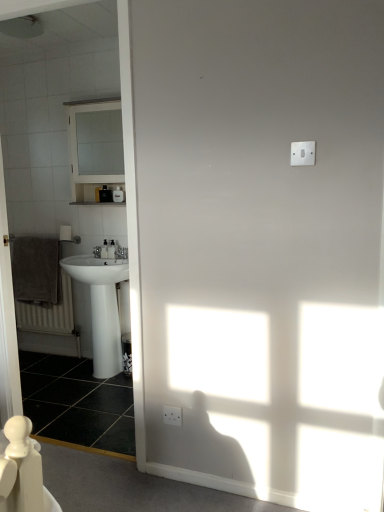
Question: From the image's perspective, does brown textured towel at left appear higher than white glossy medicine cabinet at upper left?

Choices:
 (A) no
 (B) yes

Answer: (A)

Question: Is the position of brown textured towel at left less distant than that of white glossy medicine cabinet at upper left?

Choices:
 (A) yes
 (B) no

Answer: (B)

Question: From a real-world perspective, does brown textured towel at left stand above white glossy medicine cabinet at upper left?

Choices:
 (A) no
 (B) yes

Answer: (A)

Question: Does brown textured towel at left have a larger size compared to white glossy medicine cabinet at upper left?

Choices:
 (A) yes
 (B) no

Answer: (B)

Question: Is brown textured towel at left completely or partially outside of white glossy medicine cabinet at upper left?

Choices:
 (A) no
 (B) yes

Answer: (B)

Question: Is brown textured towel at left wider than white glossy medicine cabinet at upper left?

Choices:
 (A) no
 (B) yes

Answer: (A)

Question: Can you confirm if black glossy tile at lower left is positioned to the left of brown textured towel at left?

Choices:
 (A) no
 (B) yes

Answer: (A)

Question: Does black glossy tile at lower left have a lesser width compared to brown textured towel at left?

Choices:
 (A) no
 (B) yes

Answer: (A)

Question: From the image's perspective, is black glossy tile at lower left beneath brown textured towel at left?

Choices:
 (A) yes
 (B) no

Answer: (A)

Question: From the image's perspective, would you say black glossy tile at lower left is positioned over brown textured towel at left?

Choices:
 (A) no
 (B) yes

Answer: (A)

Question: From a real-world perspective, is black glossy tile at lower left located beneath brown textured towel at left?

Choices:
 (A) no
 (B) yes

Answer: (B)

Question: From a real-world perspective, is black glossy tile at lower left located higher than brown textured towel at left?

Choices:
 (A) no
 (B) yes

Answer: (A)

Question: Does brown textured towel at left have a lesser width compared to white glossy sink at left?

Choices:
 (A) no
 (B) yes

Answer: (B)